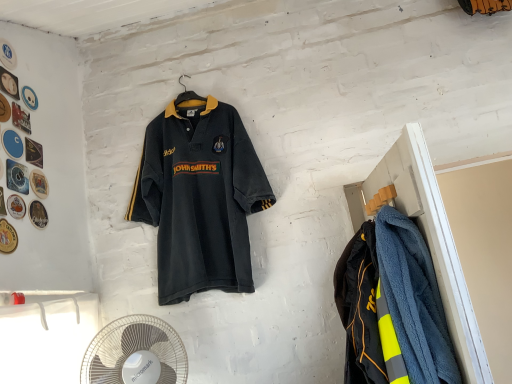
You are a GUI agent. You are given a task and a screenshot of the screen. Output one action in this format:
    pyautogui.click(x=<x>, y=<y>)
    Task: Click on the neon yellow reflective jacket at right
    
    Given the screenshot: What is the action you would take?
    pyautogui.click(x=361, y=309)

The height and width of the screenshot is (384, 512). I want to click on dark gray jersey at center, so click(199, 197).

From the image's perspective, is white plastic fan at lower left beneath blue fuzzy coat at right?

Yes, from the image's perspective, white plastic fan at lower left is below blue fuzzy coat at right.

Which of these two, white plastic fan at lower left or blue fuzzy coat at right, stands taller?

With more height is blue fuzzy coat at right.

From a real-world perspective, between white plastic fan at lower left and blue fuzzy coat at right, who is vertically lower?

white plastic fan at lower left.

Between dark gray jersey at center and blue fuzzy coat at right, which one has larger width?

With larger width is dark gray jersey at center.

Which point is more forward, (197, 216) or (417, 171)?

Point (417, 171)

Considering the positions of objects dark gray jersey at center and blue fuzzy coat at right in the image provided, who is more to the right, dark gray jersey at center or blue fuzzy coat at right?

blue fuzzy coat at right is more to the right.

Is dark gray jersey at center behind blue fuzzy coat at right?

Yes, it is behind blue fuzzy coat at right.

Considering the relative positions of blue fuzzy coat at right and neon yellow reflective jacket at right in the image provided, is blue fuzzy coat at right to the left of neon yellow reflective jacket at right from the viewer's perspective?

Incorrect, blue fuzzy coat at right is not on the left side of neon yellow reflective jacket at right.

Is the depth of blue fuzzy coat at right less than that of neon yellow reflective jacket at right?

Yes, blue fuzzy coat at right is in front of neon yellow reflective jacket at right.

Do you think blue fuzzy coat at right is within neon yellow reflective jacket at right, or outside of it?

blue fuzzy coat at right lies outside neon yellow reflective jacket at right.

Is blue fuzzy coat at right taller or shorter than neon yellow reflective jacket at right?

Considering their sizes, blue fuzzy coat at right has more height than neon yellow reflective jacket at right.

From a real-world perspective, relative to white plastic fan at lower left, is blue fuzzy coat at right vertically above or below?

Clearly, from a real-world perspective, blue fuzzy coat at right is above white plastic fan at lower left.

Identify the location of mechanical fan behind the blue fuzzy coat at right. (135, 353).

Between blue fuzzy coat at right and white plastic fan at lower left, which one has larger width?

With larger width is white plastic fan at lower left.

Can you confirm if blue fuzzy coat at right is positioned to the right of white plastic fan at lower left?

Yes, blue fuzzy coat at right is to the right of white plastic fan at lower left.

Consider the image. Who is shorter, dark gray jersey at center or white plastic fan at lower left?

white plastic fan at lower left is shorter.

Where is `sports uniform located behind the white plastic fan at lower left`? The height and width of the screenshot is (384, 512). sports uniform located behind the white plastic fan at lower left is located at coordinates (199, 197).

Which point is more distant from viewer, (169, 220) or (143, 368)?

The point (169, 220) is farther.

Based on their positions, is white plastic fan at lower left located to the left or right of dark gray jersey at center?

Clearly, white plastic fan at lower left is on the left of dark gray jersey at center in the image.

Is there a large distance between white plastic fan at lower left and dark gray jersey at center?

white plastic fan at lower left is near dark gray jersey at center, not far away.

Does white plastic fan at lower left lie behind dark gray jersey at center?

No.

Considering the relative sizes of white plastic fan at lower left and dark gray jersey at center in the image provided, is white plastic fan at lower left smaller than dark gray jersey at center?

Correct, white plastic fan at lower left occupies less space than dark gray jersey at center.

Does neon yellow reflective jacket at right have a larger size compared to blue fuzzy coat at right?

Actually, neon yellow reflective jacket at right might be smaller than blue fuzzy coat at right.

How distant is neon yellow reflective jacket at right from blue fuzzy coat at right?

neon yellow reflective jacket at right is 8.74 inches away from blue fuzzy coat at right.

From a real-world perspective, which object rests below the other?

neon yellow reflective jacket at right is physically lower.

The width and height of the screenshot is (512, 384). I want to click on closet in front of the neon yellow reflective jacket at right, so click(426, 238).

What are the coordinates of `closet located on the right of white plastic fan at lower left` in the screenshot? It's located at (426, 238).

Identify the location of sports uniform on the left of blue fuzzy coat at right. Image resolution: width=512 pixels, height=384 pixels. (199, 197).

From the picture: Based on their spatial positions, is neon yellow reflective jacket at right or blue fuzzy coat at right closer to dark gray jersey at center?

The object closer to dark gray jersey at center is neon yellow reflective jacket at right.

Consider the image. Based on their spatial positions, is dark gray jersey at center or blue fuzzy coat at right closer to white plastic fan at lower left?

Among the two, dark gray jersey at center is located nearer to white plastic fan at lower left.

Estimate the real-world distances between objects in this image. Which object is further from blue fuzzy coat at right, dark gray jersey at center or white plastic fan at lower left?

Based on the image, white plastic fan at lower left appears to be further to blue fuzzy coat at right.

When comparing their distances from neon yellow reflective jacket at right, does dark gray jersey at center or blue fuzzy coat at right seem further?

dark gray jersey at center.

When comparing their distances from white plastic fan at lower left, does blue fuzzy coat at right or neon yellow reflective jacket at right seem further?

blue fuzzy coat at right is further to white plastic fan at lower left.

Considering their positions, is white plastic fan at lower left positioned closer to blue fuzzy coat at right than dark gray jersey at center?

dark gray jersey at center.

Considering their positions, is blue fuzzy coat at right positioned further to white plastic fan at lower left than dark gray jersey at center?

The object further to white plastic fan at lower left is blue fuzzy coat at right.

From the image, which object appears to be nearer to dark gray jersey at center, white plastic fan at lower left or neon yellow reflective jacket at right?

white plastic fan at lower left.

This screenshot has width=512, height=384. I want to click on garment situated between dark gray jersey at center and blue fuzzy coat at right from left to right, so click(x=361, y=309).

Locate an element on the screen. This screenshot has height=384, width=512. garment between white plastic fan at lower left and blue fuzzy coat at right in the horizontal direction is located at coordinates (361, 309).

You are a GUI agent. You are given a task and a screenshot of the screen. Output one action in this format:
    pyautogui.click(x=<x>, y=<y>)
    Task: Click on the sports uniform between white plastic fan at lower left and neon yellow reflective jacket at right from left to right
    
    Given the screenshot: What is the action you would take?
    pyautogui.click(x=199, y=197)

The height and width of the screenshot is (384, 512). Find the location of `sports uniform between white plastic fan at lower left and blue fuzzy coat at right`. sports uniform between white plastic fan at lower left and blue fuzzy coat at right is located at coordinates (199, 197).